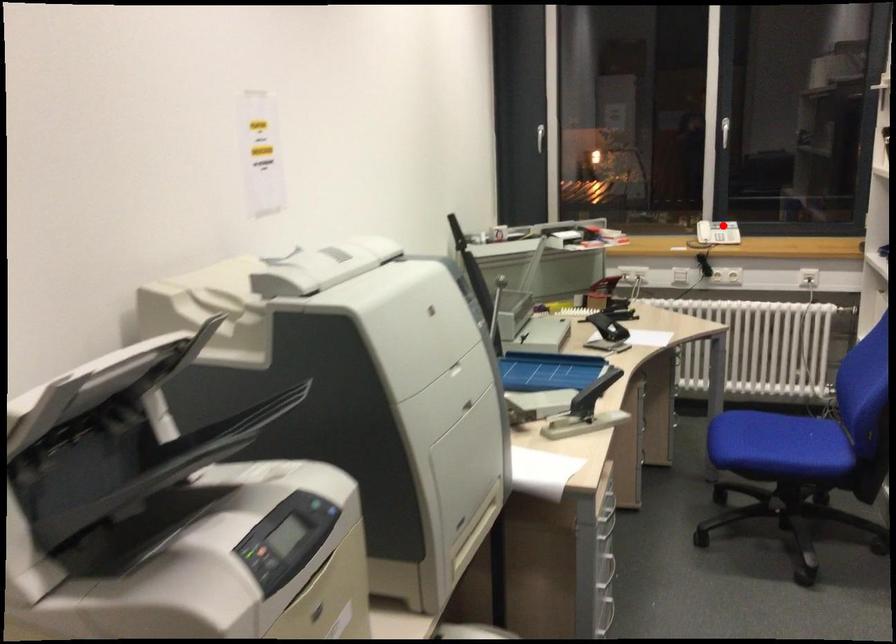
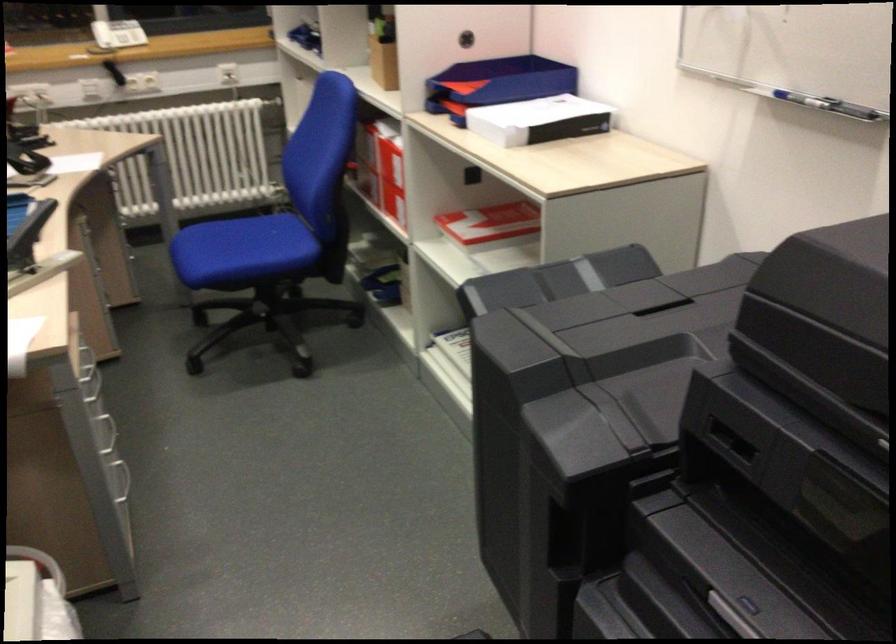
Where in the second image is the point corresponding to the highlighted location from the first image?

(117, 33)